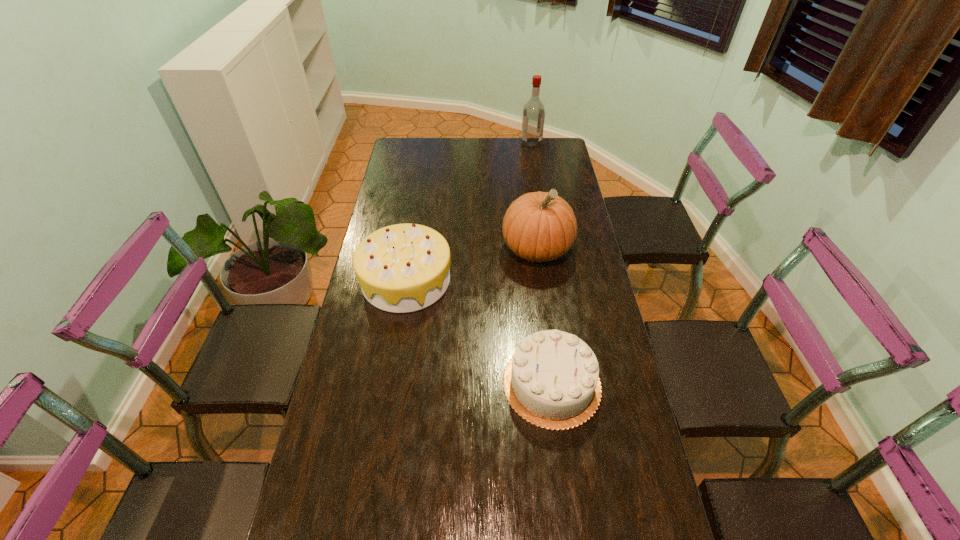
Where is `blank area in the image that satisfies the following two spatial constraints: 1. on the front-facing side of the liquor; 2. on the stem of the second tallest object`? This screenshot has height=540, width=960. blank area in the image that satisfies the following two spatial constraints: 1. on the front-facing side of the liquor; 2. on the stem of the second tallest object is located at coordinates (548, 249).

Locate an element on the screen. The height and width of the screenshot is (540, 960). free spot that satisfies the following two spatial constraints: 1. on the front-facing side of the liquor; 2. on the stem of the second tallest object is located at coordinates (548, 249).